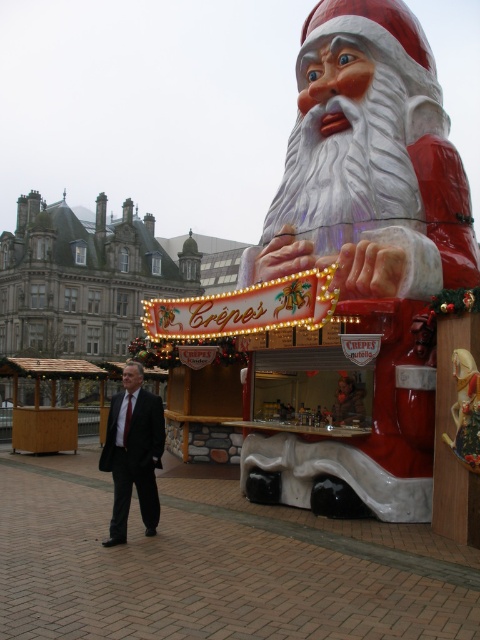
You are organizing a Christmas market and need to place a 1.5 meter wide tent between the matte plastic santa at center and the dark suit at center. Can you fit the tent between them?

The matte plastic santa at center might be wider than dark suit at center, so the tent may not fit between them. Check the actual width before placing the tent.

You are a customer who wants to order crapes from the kiosk. You see the matte plastic santa at center and the dark suit at center. Which object is on the right side when facing the kiosk?

The matte plastic santa at center is positioned on the right side of dark suit at center, so when facing the kiosk, the matte plastic santa at center is on the right side.